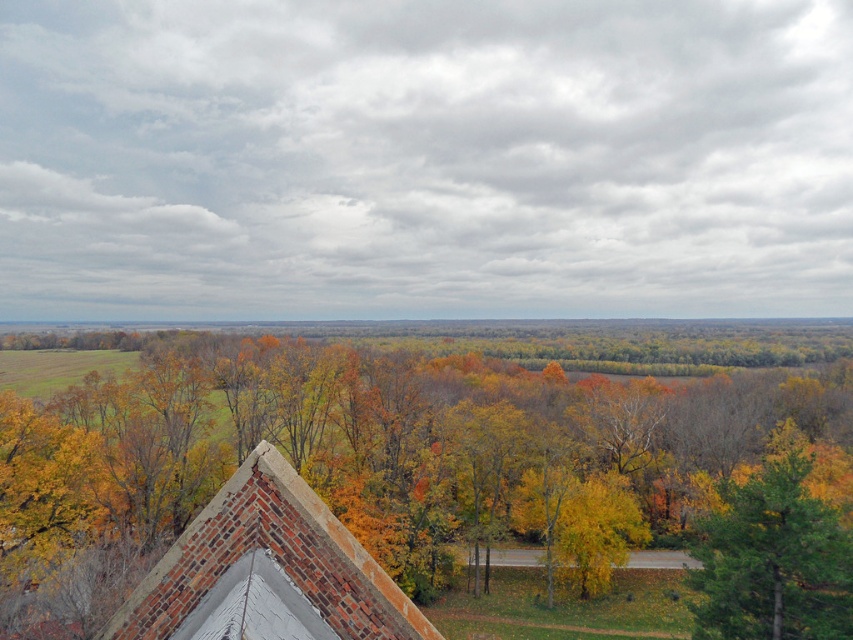
You are standing at the edge of the brick structure in the foreground and want to collect the yellow leaves at center. In which direction should you walk to reach them?

The yellow leaves at center are located at point coordinates that are to the right and slightly forward from your position at the brick structure edge. Walk towards the center of the image where the yellow leaves are positioned.

You are standing at the brick structure in the foreground and want to reach a point in the distance. Which of the two points, point (468, 582) or point (735, 513), is farther away from your current position?

Point (468, 582) is farther away from your current position because it is behind point (735, 513).